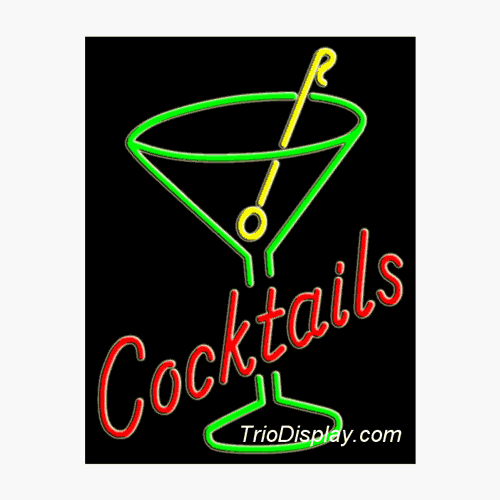
Locate an element on the screen. This screenshot has height=500, width=500. the bottom of glass is located at coordinates click(271, 414).